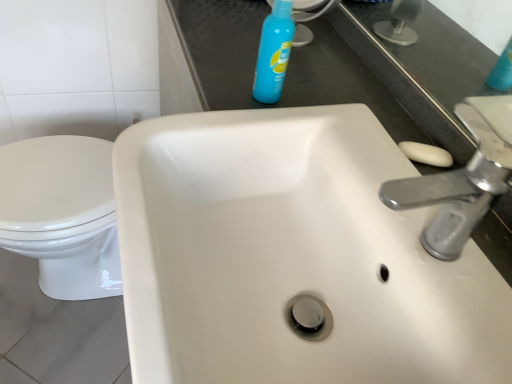
Where is `spots to the right of silver metallic faucet at upper right`? spots to the right of silver metallic faucet at upper right is located at coordinates (483, 268).